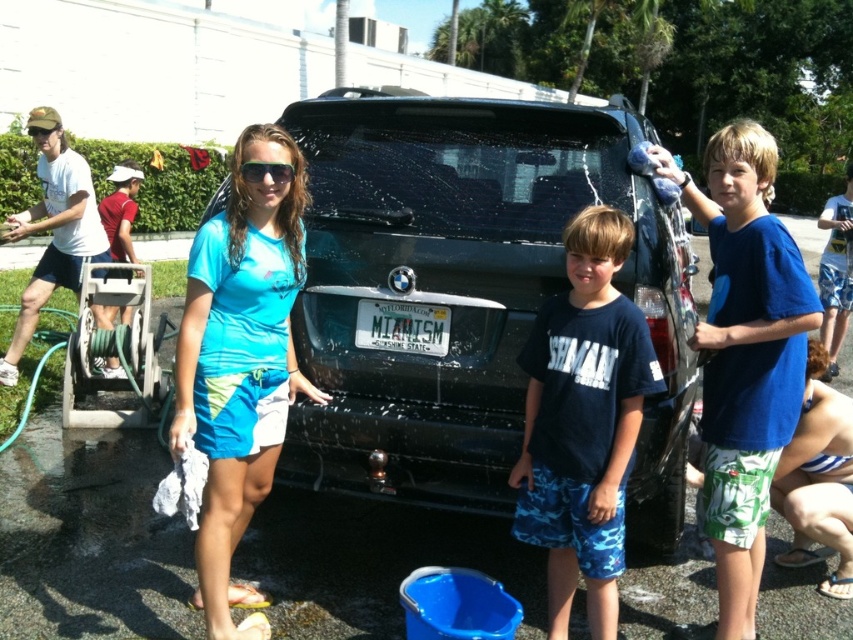
Is glossy black suv at center further to the viewer compared to green matte goggles at upper center?

No, it is not.

Locate an element on the screen. glossy black suv at center is located at coordinates (467, 292).

I want to click on glossy black suv at center, so click(x=467, y=292).

Between red fabric hose at left and green matte goggles at upper center, which one appears on the right side from the viewer's perspective?

green matte goggles at upper center is more to the right.

What do you see at coordinates (120, 209) in the screenshot?
I see `red fabric hose at left` at bounding box center [120, 209].

Where is `red fabric hose at left`? Image resolution: width=853 pixels, height=640 pixels. red fabric hose at left is located at coordinates (120, 209).

Is blue camouflage shorts at center further to camera compared to matte black sunglasses at center?

No, blue camouflage shorts at center is in front of matte black sunglasses at center.

Measure the distance between point (595, 600) and camera.

A distance of 9.32 feet exists between point (595, 600) and camera.

Between point (619, 484) and point (289, 163), which one is positioned in front?

Point (619, 484)

The width and height of the screenshot is (853, 640). I want to click on blue camouflage shorts at center, so click(583, 420).